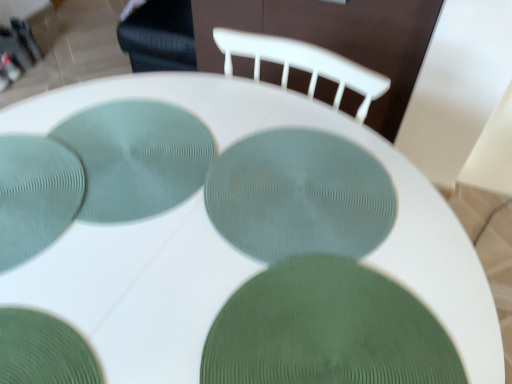
You are a GUI agent. You are given a task and a screenshot of the screen. Output one action in this format:
    pyautogui.click(x=<x>, y=<y>)
    Task: Click on the free spot above matte green plate at lower left, which is the first glass plate in left-to-right order (from a real-world perspective)
    
    Given the screenshot: What is the action you would take?
    pyautogui.click(x=33, y=184)